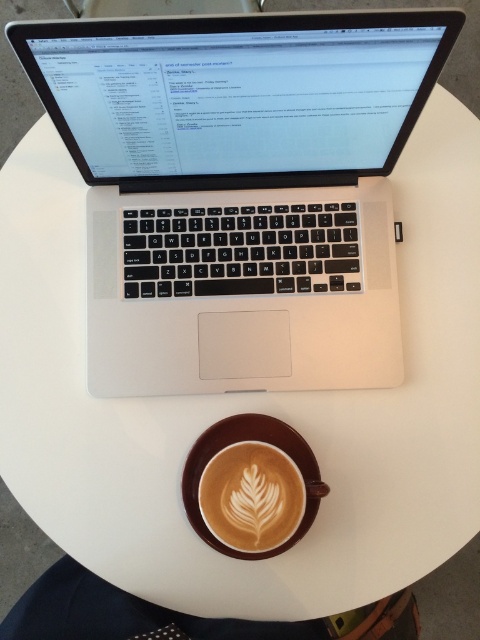
You are setting up a new monitor stand that requires 10 cm of vertical space. You have the silver metallic laptop at upper center and the white frothy art at center in front of you. Which object do you think will fit in the vertical space required for the monitor stand?

The white frothy art at center is shorter than the silver metallic laptop at upper center, so it will fit in the 10 cm vertical space required for the monitor stand.

You are organizing a presentation and need to place both the silver metallic laptop at upper center and the white frothy art at center on a shelf. The shelf has limited space. Based on their positions in the image, which object is closer to the edge of the shelf and might need to be moved inward to prevent falling?

The silver metallic laptop at upper center is positioned over the white frothy art at center, meaning it is closer to the edge of the shelf and should be moved inward to prevent falling.